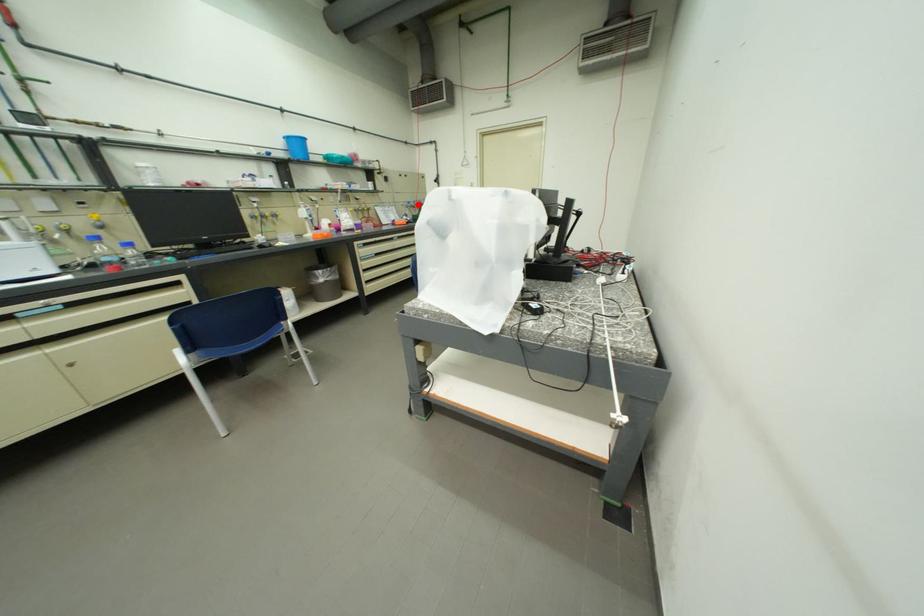
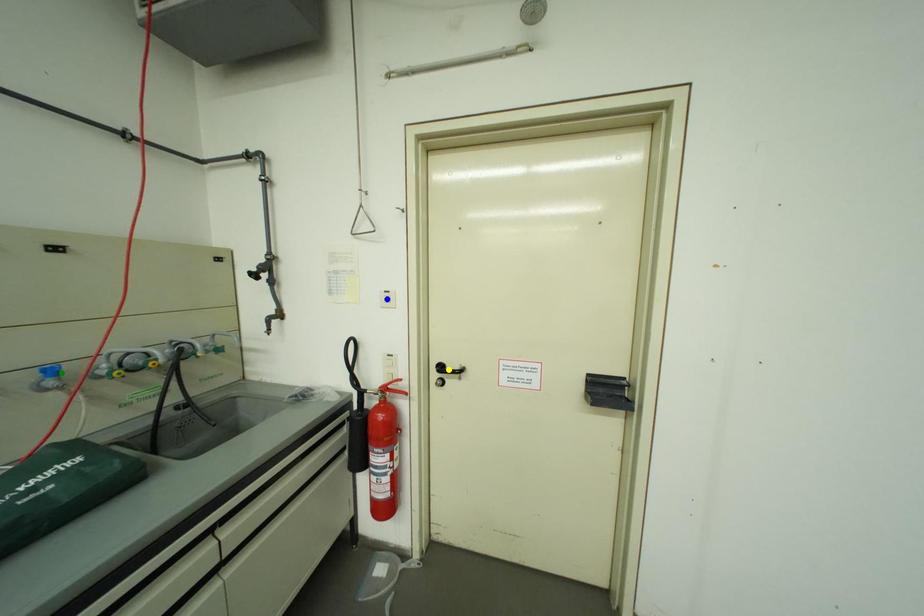
Question: I am providing you with two images of the same scene from different viewpoints. A red point is marked on the first image. You are given multiple points on the second image. In image 2, which mark is for the same physical point as the one in image 1?

Choices:
 (A) yellow point
 (B) blue point
 (C) green point

Answer: (C)